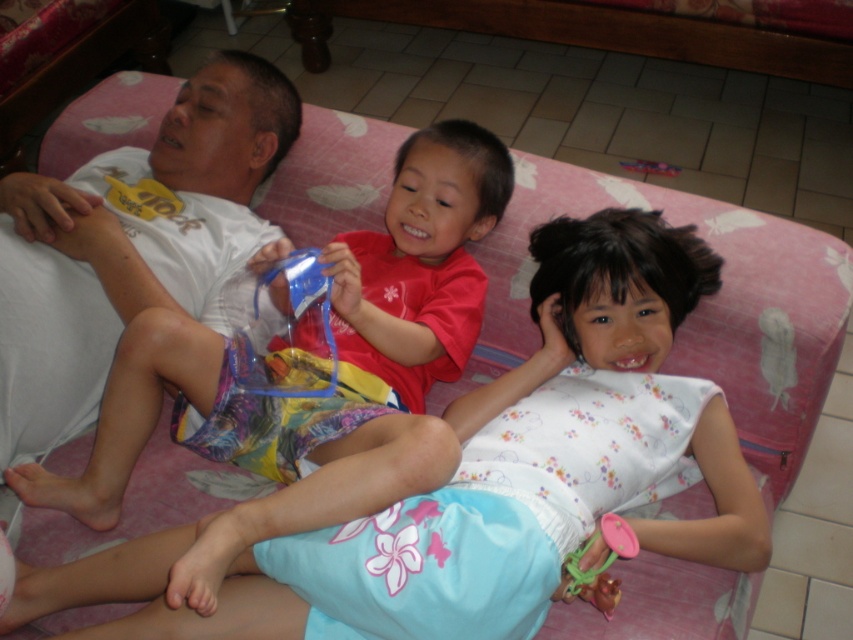
Question: Which object is positioned farthest from the pink plastic toy at lower right?

Choices:
 (A) floral cotton dress at center
 (B) red matte shirt at center

Answer: (B)

Question: Considering the relative positions of floral cotton dress at center and pink plastic toy at lower right in the image provided, where is floral cotton dress at center located with respect to pink plastic toy at lower right?

Choices:
 (A) right
 (B) left

Answer: (B)

Question: Which point is closer to the camera?

Choices:
 (A) floral cotton dress at center
 (B) pink plastic toy at lower right
 (C) red matte shirt at center

Answer: (A)

Question: Considering the real-world distances, which object is farthest from the red matte shirt at center?

Choices:
 (A) pink plastic toy at lower right
 (B) floral cotton dress at center

Answer: (A)

Question: Is red matte shirt at center bigger than pink plastic toy at lower right?

Choices:
 (A) no
 (B) yes

Answer: (B)

Question: Is floral cotton dress at center wider than pink plastic toy at lower right?

Choices:
 (A) no
 (B) yes

Answer: (B)